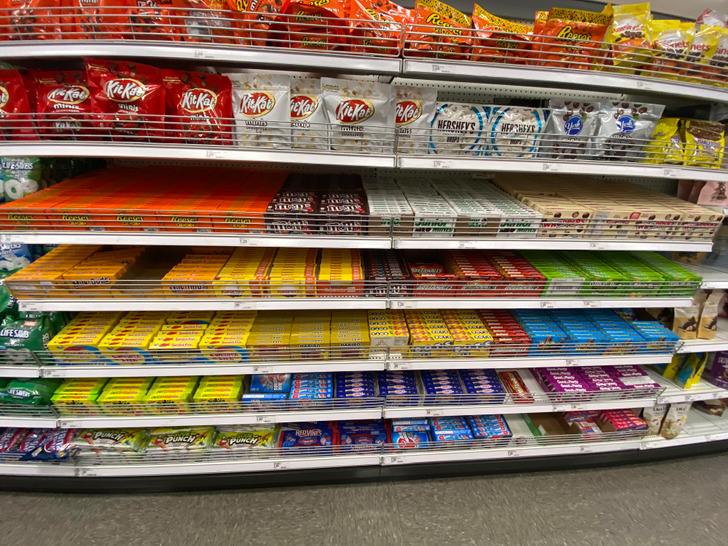
The width and height of the screenshot is (728, 546). I want to click on seven white shelves of candy, so click(x=339, y=445), click(x=340, y=405), click(x=332, y=351), click(x=324, y=295), click(x=324, y=227), click(x=328, y=158), click(x=343, y=56).